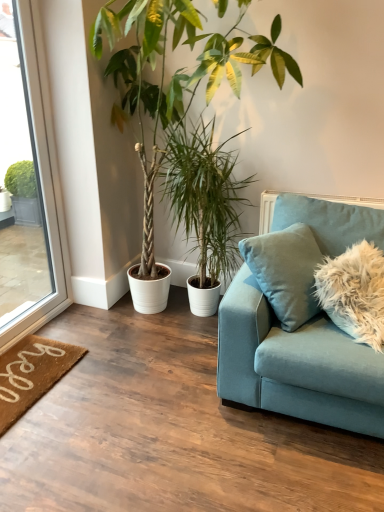
Question: From a real-world perspective, is teal velvet couch at right physically located above or below green leafy plant at center, placed as the 2th houseplant when sorted from left to right?

Choices:
 (A) below
 (B) above

Answer: (A)

Question: In terms of height, does teal velvet couch at right look taller or shorter compared to green leafy plant at center, the first houseplant positioned from the right?

Choices:
 (A) short
 (B) tall

Answer: (A)

Question: Which of these objects is positioned farthest from the green leafy plant at center, placed as the 2th houseplant when sorted from left to right?

Choices:
 (A) brown coir doormat at lower left
 (B) green leafy plant at upper left, positioned as the second houseplant in right-to-left order
 (C) clear glass window at left
 (D) fluffy light brown pillow at right
 (E) teal velvet couch at right

Answer: (A)

Question: Considering the real-world distances, which object is farthest from the teal velvet couch at right?

Choices:
 (A) green leafy plant at upper left, positioned as the second houseplant in right-to-left order
 (B) brown coir doormat at lower left
 (C) clear glass window at left
 (D) green leafy plant at center, placed as the 2th houseplant when sorted from left to right
 (E) fluffy light brown pillow at right

Answer: (C)